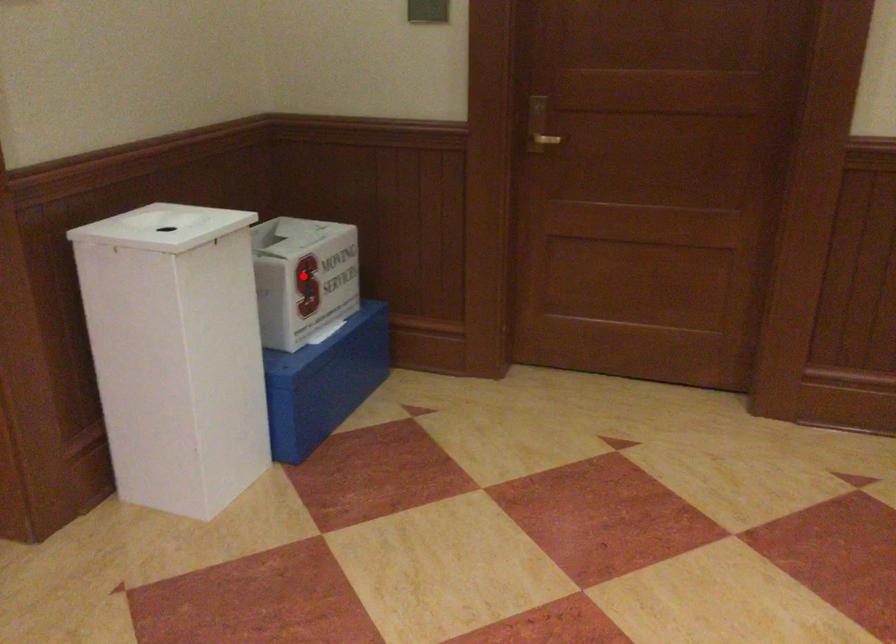
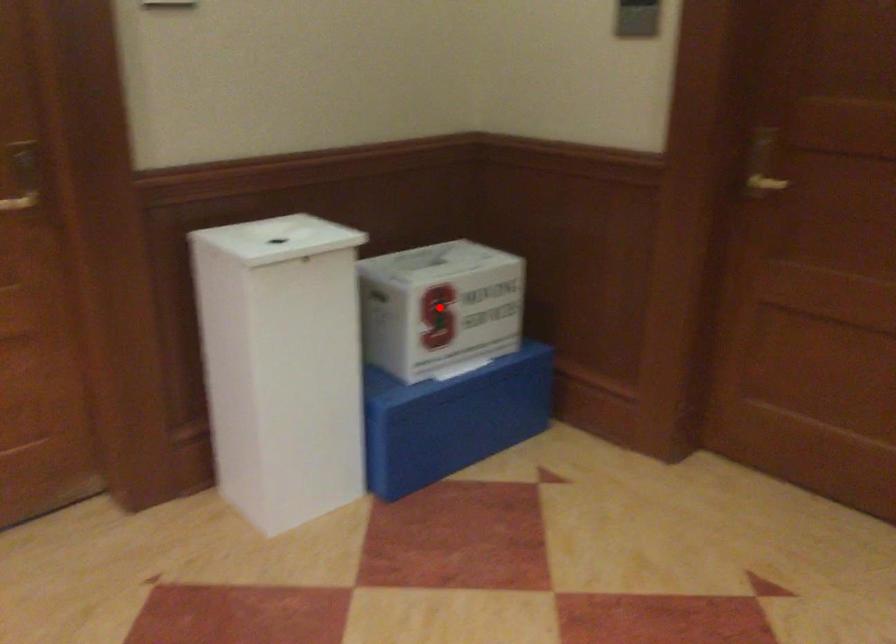
I am providing you with two images of the same scene from different viewpoints. A red point is marked on the first image and another point is marked on the second image. Do the highlighted points in image1 and image2 indicate the same real-world spot?

Yes